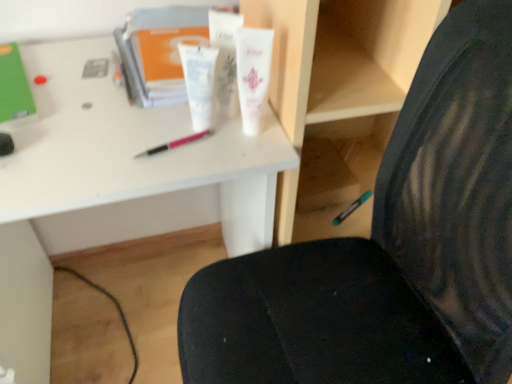
Question: Should I look upward or downward to see white plastic book at upper center?

Choices:
 (A) down
 (B) up

Answer: (B)

Question: Is pink plastic pen at center far from green matte marker at lower right, which is counted as the first stationery, starting from the back?

Choices:
 (A) yes
 (B) no

Answer: (B)

Question: Does pink plastic pen at center appear on the left side of green matte marker at lower right, the first stationery from the right?

Choices:
 (A) yes
 (B) no

Answer: (A)

Question: Considering the relative sizes of pink plastic pen at center and green matte marker at lower right, the first stationery from the right, in the image provided, is pink plastic pen at center smaller than green matte marker at lower right, the first stationery from the right,?

Choices:
 (A) no
 (B) yes

Answer: (B)

Question: Is pink plastic pen at center positioned before green matte marker at lower right, which is counted as the first stationery, starting from the back?

Choices:
 (A) no
 (B) yes

Answer: (B)

Question: From the image's perspective, is pink plastic pen at center located above green matte marker at lower right, which ranks as the 2th stationery in top-to-bottom order?

Choices:
 (A) no
 (B) yes

Answer: (B)

Question: From a real-world perspective, is pink plastic pen at center on top of green matte marker at lower right, which is counted as the first stationery, starting from the back?

Choices:
 (A) yes
 (B) no

Answer: (A)

Question: Is white plastic desk at center positioned beyond the bounds of white glossy tube at center, positioned as the 3th toiletry in right-to-left order?

Choices:
 (A) no
 (B) yes

Answer: (B)

Question: Does white plastic desk at center contain white glossy tube at center, positioned as the 3th toiletry in right-to-left order?

Choices:
 (A) yes
 (B) no

Answer: (B)

Question: Considering the relative positions of white plastic desk at center and white glossy tube at center, positioned as the 3th toiletry in right-to-left order, in the image provided, is white plastic desk at center behind white glossy tube at center, positioned as the 3th toiletry in right-to-left order,?

Choices:
 (A) yes
 (B) no

Answer: (B)

Question: Does white plastic desk at center have a larger size compared to white glossy tube at center, positioned as the 3th toiletry in right-to-left order?

Choices:
 (A) no
 (B) yes

Answer: (B)

Question: Considering the relative sizes of white plastic desk at center and white glossy tube at center, arranged as the 1th toiletry when viewed from the left, in the image provided, is white plastic desk at center taller than white glossy tube at center, arranged as the 1th toiletry when viewed from the left,?

Choices:
 (A) no
 (B) yes

Answer: (B)

Question: Is white plastic desk at center closer to the viewer compared to white glossy tube at center, arranged as the 1th toiletry when viewed from the left?

Choices:
 (A) no
 (B) yes

Answer: (B)

Question: Is green matte marker at lower right, which is the second stationery in left-to-right order, at the right side of green matte folder at upper left, positioned as the first stationery in front-to-back order?

Choices:
 (A) yes
 (B) no

Answer: (A)